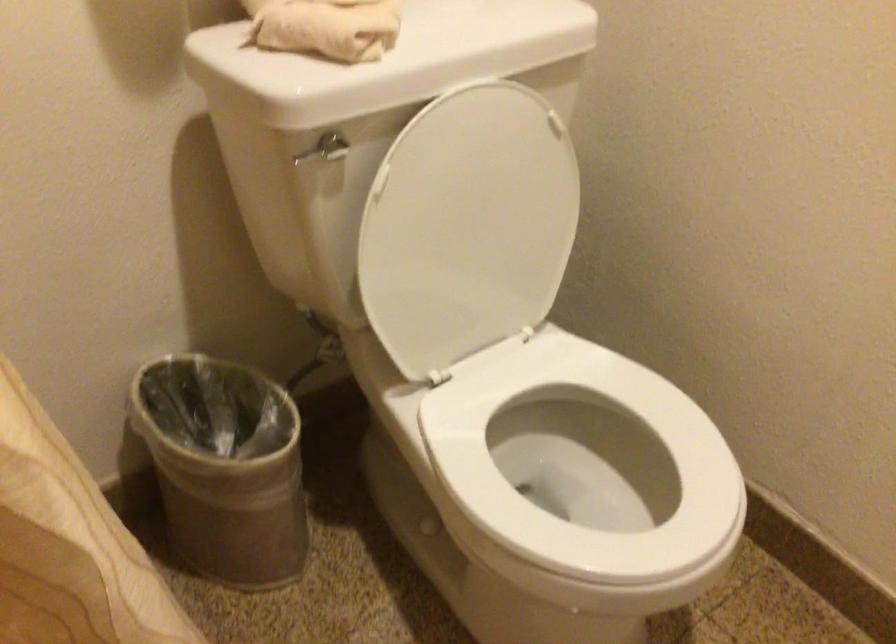
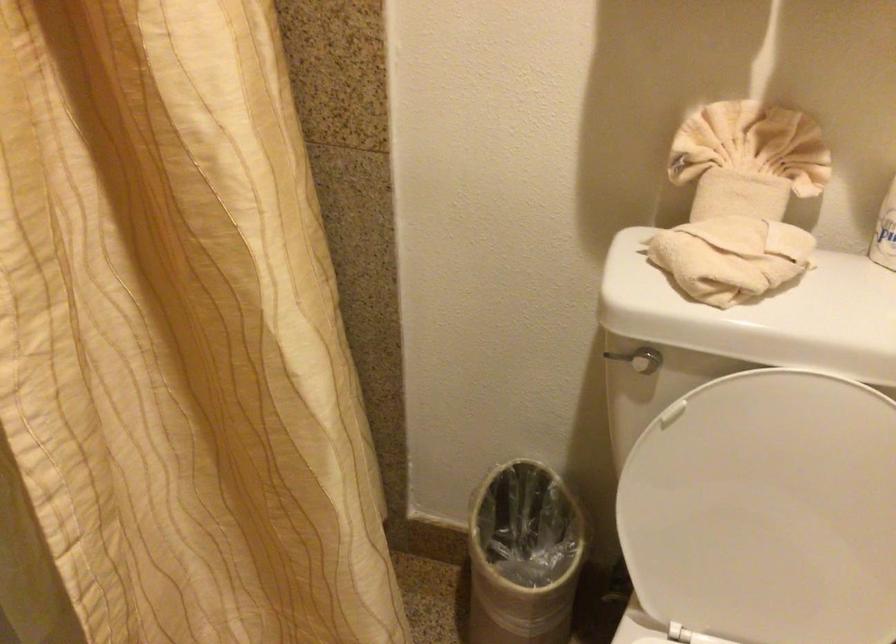
Locate, in the second image, the point that corresponds to pixel 466 230 in the first image.

(767, 511)